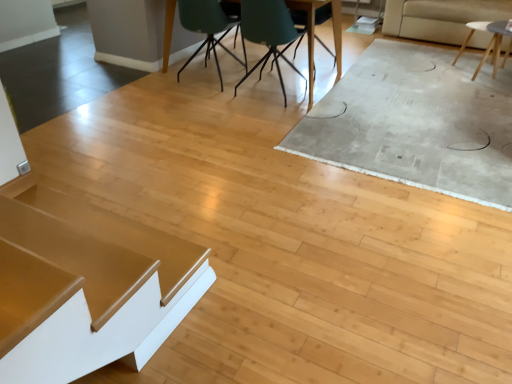
Find the location of a particular element. This screenshot has height=384, width=512. matte black table at center, the second table in the left-to-right sequence is located at coordinates (314, 35).

This screenshot has width=512, height=384. Describe the element at coordinates (318, 24) in the screenshot. I see `teal fabric chair at center, which ranks as the 3th chair in left-to-right order` at that location.

What do you see at coordinates (440, 18) in the screenshot?
I see `beige fabric couch at upper right` at bounding box center [440, 18].

The image size is (512, 384). Identify the location of white matte table at upper right, which is the 2th table in bottom-to-top order. (489, 43).

Locate an element on the screen. The width and height of the screenshot is (512, 384). shiny gold table at lower left, which is the first table from bottom to top is located at coordinates (110, 272).

I want to click on matte black table at center, the second table in the left-to-right sequence, so click(314, 35).

Is matte black table at center, which appears as the third table when ordered from the bottom, positioned behind matte teal chair at upper center, placed as the 3th chair when sorted from right to left?

No, matte black table at center, which appears as the third table when ordered from the bottom, is in front of matte teal chair at upper center, placed as the 3th chair when sorted from right to left.

From the image's perspective, which is above, matte black table at center, the second table viewed from the back, or matte teal chair at upper center, which is counted as the first chair, starting from the left?

matte black table at center, the second table viewed from the back, from the image's perspective.

Does matte black table at center, which appears as the third table when ordered from the bottom, have a larger size compared to matte teal chair at upper center, placed as the 3th chair when sorted from right to left?

Yes, matte black table at center, which appears as the third table when ordered from the bottom, is bigger than matte teal chair at upper center, placed as the 3th chair when sorted from right to left.

Which of these two, matte black table at center, which appears as the third table when ordered from the bottom, or matte teal chair at upper center, placed as the 3th chair when sorted from right to left, stands taller?

matte black table at center, which appears as the third table when ordered from the bottom.

Between matte teal chair at upper center, which is counted as the first chair, starting from the left, and white matte table at upper right, the third table in the front-to-back sequence, which one has smaller size?

white matte table at upper right, the third table in the front-to-back sequence, is smaller.

Can you confirm if matte teal chair at upper center, which is counted as the first chair, starting from the left, is positioned to the right of white matte table at upper right, which is the 2th table in bottom-to-top order?

In fact, matte teal chair at upper center, which is counted as the first chair, starting from the left, is to the left of white matte table at upper right, which is the 2th table in bottom-to-top order.

From a real-world perspective, which object rests below the other?

white matte table at upper right, which ranks as the first table in back-to-front order, is physically lower.

Is white matte table at upper right, which is the first table from right to left, spatially inside matte teal chair at upper center, which is counted as the first chair, starting from the left, or outside of it?

white matte table at upper right, which is the first table from right to left, exists outside the volume of matte teal chair at upper center, which is counted as the first chair, starting from the left.

Is white matte table at upper right, which is the first table from right to left, wider than matte teal chair at upper center, which is counted as the first chair, starting from the left?

Indeed, white matte table at upper right, which is the first table from right to left, has a greater width compared to matte teal chair at upper center, which is counted as the first chair, starting from the left.

From the image's perspective, would you say white matte table at upper right, which is the 3th table from left to right, is shown under matte teal chair at upper center, which is counted as the first chair, starting from the left?

→ Yes, from the image's perspective, white matte table at upper right, which is the 3th table from left to right, is beneath matte teal chair at upper center, which is counted as the first chair, starting from the left.

Based on the photo, in the image, is white matte table at upper right, which ranks as the first table in back-to-front order, positioned in front of or behind matte teal chair at upper center, placed as the 3th chair when sorted from right to left?

white matte table at upper right, which ranks as the first table in back-to-front order, is behind matte teal chair at upper center, placed as the 3th chair when sorted from right to left.

From the image's perspective, which one is positioned higher, matte black table at center, the second table in the left-to-right sequence, or teal fabric chair at center, the 1th chair in the right-to-left sequence?

teal fabric chair at center, the 1th chair in the right-to-left sequence, from the image's perspective.

From a real-world perspective, is matte black table at center, the second table in the left-to-right sequence, physically located above or below teal fabric chair at center, which ranks as the 3th chair in left-to-right order?

matte black table at center, the second table in the left-to-right sequence, is situated higher than teal fabric chair at center, which ranks as the 3th chair in left-to-right order, in the real world.

Is matte black table at center, which appears as the third table when ordered from the bottom, facing towards teal fabric chair at center, the 1th chair in the right-to-left sequence?

Yes, matte black table at center, which appears as the third table when ordered from the bottom, is turned towards teal fabric chair at center, the 1th chair in the right-to-left sequence.

Which of these two, matte black table at center, the second table viewed from the back, or teal fabric chair at center, which ranks as the 3th chair in left-to-right order, is bigger?

matte black table at center, the second table viewed from the back, is bigger.

Is white matte table at upper right, the third table in the front-to-back sequence, at the back of teal matte chair at center, acting as the 2th chair starting from the left?

teal matte chair at center, acting as the 2th chair starting from the left, does not have its back to white matte table at upper right, the third table in the front-to-back sequence.

Which object is positioned more to the left, teal matte chair at center, acting as the 2th chair starting from the left, or white matte table at upper right, marked as the 2th table in a top-to-bottom arrangement?

teal matte chair at center, acting as the 2th chair starting from the left.

How different are the orientations of teal matte chair at center, acting as the 2th chair starting from the left, and white matte table at upper right, marked as the 2th table in a top-to-bottom arrangement, in degrees?

175 degrees.

Locate an element on the screen. The image size is (512, 384). the 3rd chair in front of the beige fabric couch at upper right is located at coordinates (269, 33).

Considering the positions of point (396, 32) and point (272, 21), is point (396, 32) closer or farther from the camera than point (272, 21)?

Point (396, 32) appears to be farther away from the viewer than point (272, 21).

What's the angular difference between beige fabric couch at upper right and teal matte chair at center, acting as the 2th chair starting from the left,'s facing directions?

The angular difference between beige fabric couch at upper right and teal matte chair at center, acting as the 2th chair starting from the left, is 178 degrees.

Is beige fabric couch at upper right wider or thinner than teal matte chair at center, the 2th chair in the right-to-left sequence?

Clearly, beige fabric couch at upper right has more width compared to teal matte chair at center, the 2th chair in the right-to-left sequence.

Based on the photo, which object is positioned more to the left, teal fabric chair at center, the 1th chair in the right-to-left sequence, or matte black table at center, the second table in the left-to-right sequence?

matte black table at center, the second table in the left-to-right sequence, is more to the left.

What's the angular difference between teal fabric chair at center, which ranks as the 3th chair in left-to-right order, and matte black table at center, the second table viewed from the back,'s facing directions?

They differ by 177 degrees in their facing directions.

Consider the image. Considering the sizes of objects teal fabric chair at center, which ranks as the 3th chair in left-to-right order, and matte black table at center, the second table positioned from the right, in the image provided, who is taller, teal fabric chair at center, which ranks as the 3th chair in left-to-right order, or matte black table at center, the second table positioned from the right,?

matte black table at center, the second table positioned from the right.

Image resolution: width=512 pixels, height=384 pixels. Identify the location of the 1st chair positioned below the matte black table at center, the second table from the front (from a real-world perspective). (208, 28).

From the image's perspective, count 1st chairs upward from the white matte table at upper right, which is the 2th table in bottom-to-top order, and point to it. Please provide its 2D coordinates.

[(208, 28)]

Looking at the image, which one is located further to teal matte chair at center, acting as the 2th chair starting from the left, beige fabric couch at upper right or teal fabric chair at center, the 1th chair in the right-to-left sequence?

beige fabric couch at upper right is further to teal matte chair at center, acting as the 2th chair starting from the left.

Estimate the real-world distances between objects in this image. Which object is further from matte black table at center, the second table viewed from the back, beige fabric couch at upper right or shiny gold table at lower left, the first table positioned from the left?

Based on the image, shiny gold table at lower left, the first table positioned from the left, appears to be further to matte black table at center, the second table viewed from the back.

Estimate the real-world distances between objects in this image. Which object is closer to matte black table at center, the second table from the front, shiny gold table at lower left, acting as the 3th table starting from the back, or white matte table at upper right, which is the 2th table in bottom-to-top order?

white matte table at upper right, which is the 2th table in bottom-to-top order.

Considering their positions, is white matte table at upper right, which is the 3th table from left to right, positioned further to teal fabric chair at center, which ranks as the 3th chair in left-to-right order, than beige fabric couch at upper right?

The object further to teal fabric chair at center, which ranks as the 3th chair in left-to-right order, is white matte table at upper right, which is the 3th table from left to right.

Looking at the image, which one is located further to matte black table at center, the second table in the left-to-right sequence, teal matte chair at center, acting as the 2th chair starting from the left, or white matte table at upper right, which ranks as the first table in back-to-front order?

Based on the image, white matte table at upper right, which ranks as the first table in back-to-front order, appears to be further to matte black table at center, the second table in the left-to-right sequence.

Looking at the image, which one is located closer to beige fabric couch at upper right, shiny gold table at lower left, acting as the 3th table starting from the back, or matte teal chair at upper center, placed as the 3th chair when sorted from right to left?

matte teal chair at upper center, placed as the 3th chair when sorted from right to left, is closer to beige fabric couch at upper right.

Based on their spatial positions, is teal matte chair at center, acting as the 2th chair starting from the left, or teal fabric chair at center, which ranks as the 3th chair in left-to-right order, closer to matte teal chair at upper center, which is counted as the first chair, starting from the left?

The object closer to matte teal chair at upper center, which is counted as the first chair, starting from the left, is teal matte chair at center, acting as the 2th chair starting from the left.

Estimate the real-world distances between objects in this image. Which object is closer to matte black table at center, the second table positioned from the right, teal matte chair at center, acting as the 2th chair starting from the left, or beige fabric couch at upper right?

teal matte chair at center, acting as the 2th chair starting from the left, lies closer to matte black table at center, the second table positioned from the right, than the other object.

Locate an element on the screen. The image size is (512, 384). table between teal matte chair at center, the 2th chair in the right-to-left sequence, and beige fabric couch at upper right, in the horizontal direction is located at coordinates (489, 43).

Identify the location of table located between shiny gold table at lower left, the 3th table from the right, and matte teal chair at upper center, placed as the 3th chair when sorted from right to left, in the depth direction. pos(314,35).

Identify the location of table between teal fabric chair at center, the 1th chair in the right-to-left sequence, and beige fabric couch at upper right, in the horizontal direction. Image resolution: width=512 pixels, height=384 pixels. (489, 43).

Where is `table between matte teal chair at upper center, placed as the 3th chair when sorted from right to left, and white matte table at upper right, which is the 2th table in bottom-to-top order, from left to right`? This screenshot has height=384, width=512. table between matte teal chair at upper center, placed as the 3th chair when sorted from right to left, and white matte table at upper right, which is the 2th table in bottom-to-top order, from left to right is located at coordinates (314, 35).